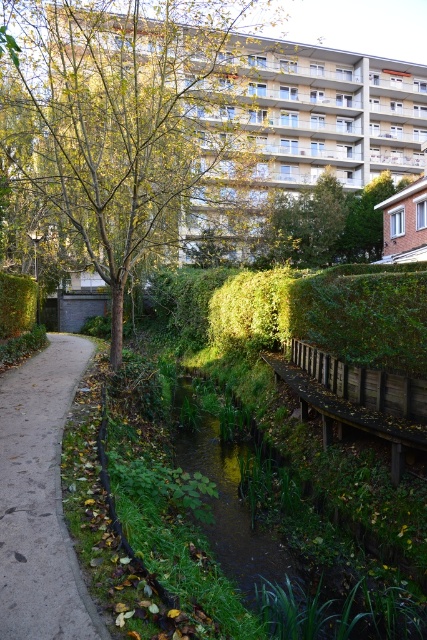
Question: Estimate the real-world distances between objects in this image. Which object is closer to the green leafy tree at upper center?

Choices:
 (A) concrete pavement at left
 (B) green grassy waterway at lower center

Answer: (A)

Question: Is concrete pavement at left positioned behind green leafy tree at upper center?

Choices:
 (A) no
 (B) yes

Answer: (A)

Question: Based on their relative distances, which object is farther from the green leafy tree at upper center?

Choices:
 (A) green leafy tree at center
 (B) green grassy waterway at lower center

Answer: (B)

Question: Where is green leafy tree at center located in relation to concrete pavement at left in the image?

Choices:
 (A) below
 (B) above

Answer: (B)

Question: Which object is farther from the camera taking this photo?

Choices:
 (A) green leafy tree at center
 (B) green grassy waterway at lower center
 (C) green leafy tree at upper center

Answer: (C)

Question: Is concrete pavement at left to the right of green leafy tree at upper center from the viewer's perspective?

Choices:
 (A) no
 (B) yes

Answer: (A)